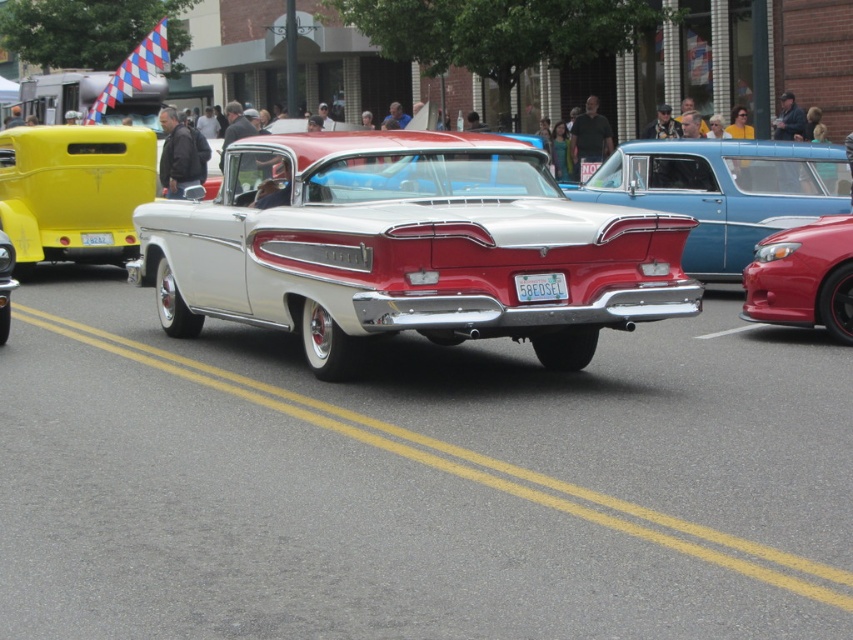
Based on the photo, you are standing in front of the classic car show and want to take a photo. You notice two points marked in the scene. Which point, point (248, 150) or point (724, 161), is closer to you?

Point (248, 150) is closer to the camera than point (724, 161), so it is closer to you.

You are standing in front of the classic car show and want to take a photo of the point at coordinates [477,298]. If your camera has a maximum focus range of 25 feet, will you be able to focus on that point?

The point at coordinates [477,298] is 24.60 feet from the camera, which is within the camera maximum focus range of 25 feet. Therefore, the camera can focus on that point.

You are a photographer trying to capture the white glossy sedan at center and the white plastic license plate at center in a single shot. Given that your camera can only focus on objects wider than 10 cm, will both objects be in focus if they are positioned side by side?

The white glossy sedan at center is wider than the white plastic license plate at center. Since the camera focuses on objects wider than 10 cm, both objects will be in focus as their widths exceed the minimum requirement.